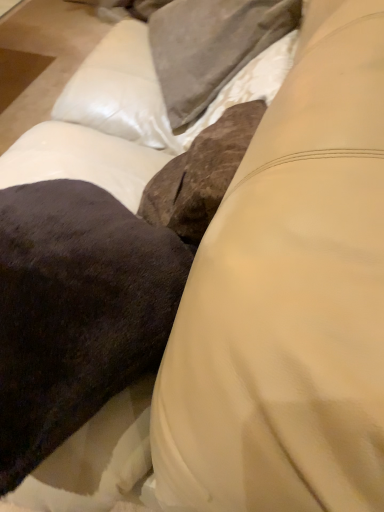
Question: Is satin gray pillow at upper center taller than velvety dark brown pillow at center?

Choices:
 (A) no
 (B) yes

Answer: (B)

Question: Is satin gray pillow at upper center facing towards velvety dark brown pillow at center?

Choices:
 (A) yes
 (B) no

Answer: (B)

Question: Is satin gray pillow at upper center turned away from velvety dark brown pillow at center?

Choices:
 (A) no
 (B) yes

Answer: (A)

Question: Does satin gray pillow at upper center have a smaller size compared to velvety dark brown pillow at center?

Choices:
 (A) yes
 (B) no

Answer: (A)

Question: Would you say satin gray pillow at upper center is a long distance from velvety dark brown pillow at center?

Choices:
 (A) yes
 (B) no

Answer: (B)

Question: Is satin gray pillow at upper center further to camera compared to velvety dark brown pillow at center?

Choices:
 (A) no
 (B) yes

Answer: (B)

Question: Is velvety dark brown pillow at center directly adjacent to satin gray pillow at upper center?

Choices:
 (A) no
 (B) yes

Answer: (A)

Question: Does velvety dark brown pillow at center have a larger size compared to satin gray pillow at upper center?

Choices:
 (A) no
 (B) yes

Answer: (B)

Question: Is velvety dark brown pillow at center looking in the opposite direction of satin gray pillow at upper center?

Choices:
 (A) yes
 (B) no

Answer: (B)

Question: Is velvety dark brown pillow at center shorter than satin gray pillow at upper center?

Choices:
 (A) no
 (B) yes

Answer: (B)

Question: Does velvety dark brown pillow at center turn towards satin gray pillow at upper center?

Choices:
 (A) no
 (B) yes

Answer: (A)

Question: Does velvety dark brown pillow at center lie behind satin gray pillow at upper center?

Choices:
 (A) yes
 (B) no

Answer: (B)

Question: From a real-world perspective, is satin gray pillow at upper center physically located above or below velvety dark brown pillow at center?

Choices:
 (A) above
 (B) below

Answer: (B)